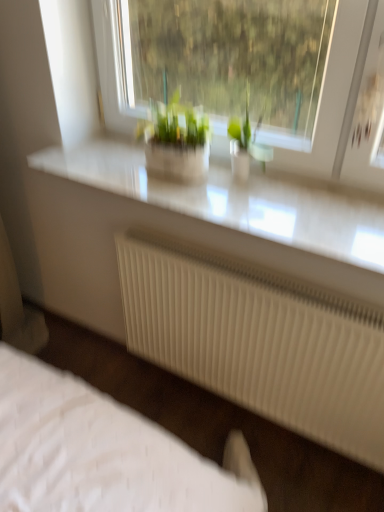
You are a GUI agent. You are given a task and a screenshot of the screen. Output one action in this format:
    pyautogui.click(x=<x>, y=<y>)
    Task: Click on the vacant space situated on the left part of green glass vase at center, which is the first houseplant in right-to-left order
    This screenshot has height=512, width=384.
    Given the screenshot: What is the action you would take?
    pyautogui.click(x=204, y=188)